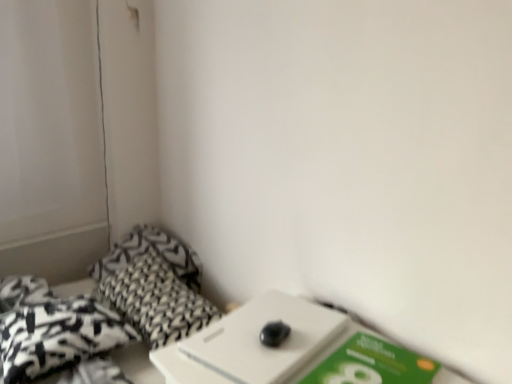
Identify the location of free space above green matte paperback book at lower right (from a real-world perspective). (367, 359).